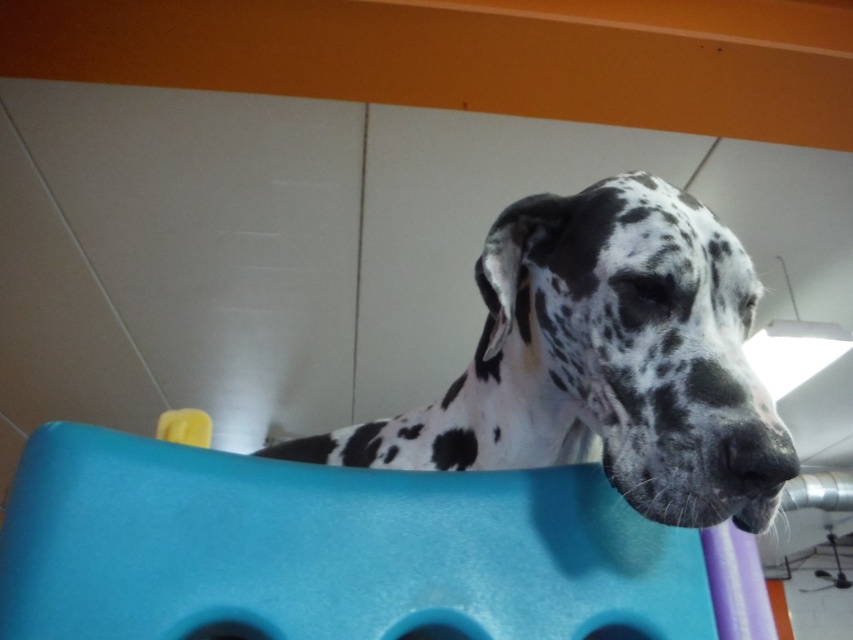
Can you confirm if blue plastic toy at center is positioned to the left of white-spotted fur dog at center?

Incorrect, blue plastic toy at center is not on the left side of white-spotted fur dog at center.

How distant is blue plastic toy at center from white-spotted fur dog at center?

blue plastic toy at center and white-spotted fur dog at center are 8.45 inches apart from each other.

Who is more distant from viewer, (x=282, y=611) or (x=535, y=294)?

The point (x=535, y=294) is behind.

At what (x,y) coordinates should I click in order to perform the action: click on blue plastic toy at center. Please return your answer as a coordinate pair (x, y). Looking at the image, I should click on (347, 552).